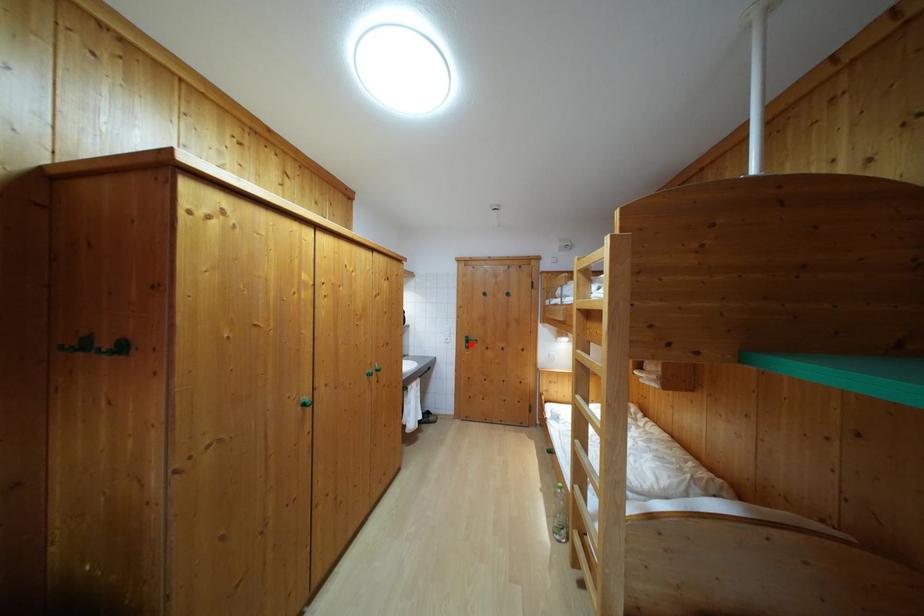
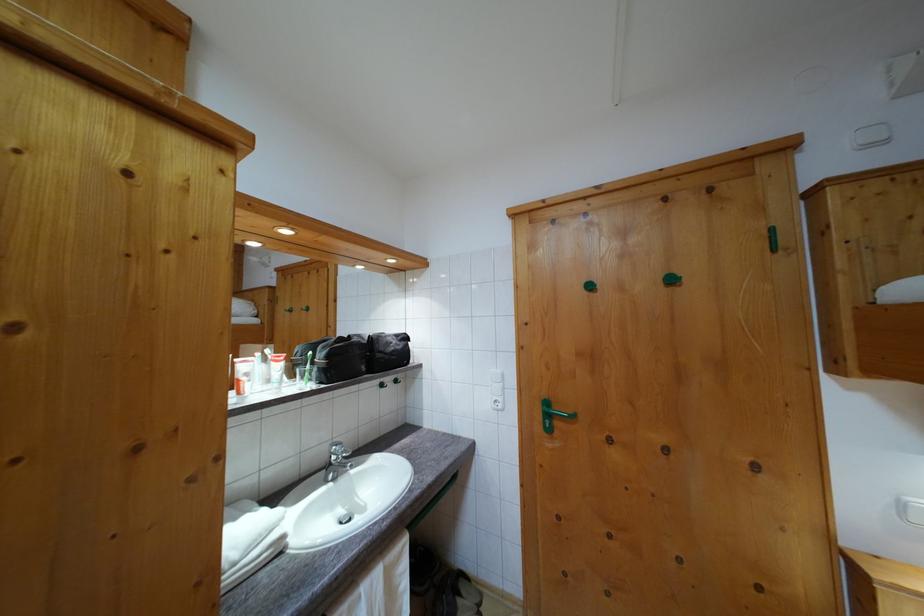
The point at the highlighted location is marked in the first image. Where is the corresponding point in the second image?

(551, 410)